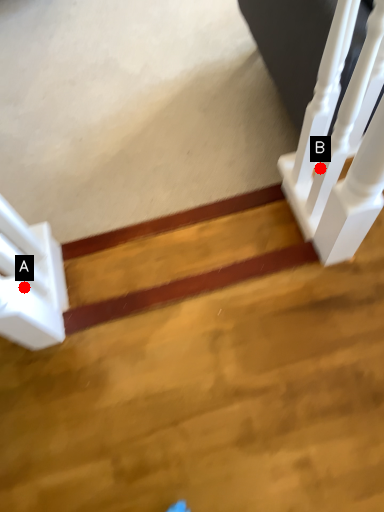
Question: Two points are circled on the image, labeled by A and B beside each circle. Which point is closer to the camera taking this photo?

Choices:
 (A) A is closer
 (B) B is closer

Answer: (A)